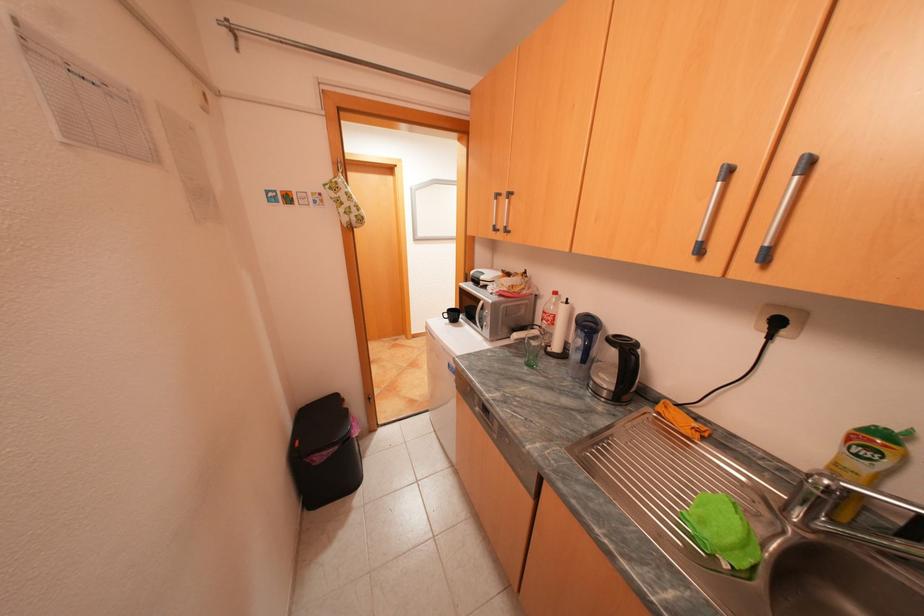
The image size is (924, 616). In order to click on black electrical plug in this screenshot , I will do `click(774, 325)`.